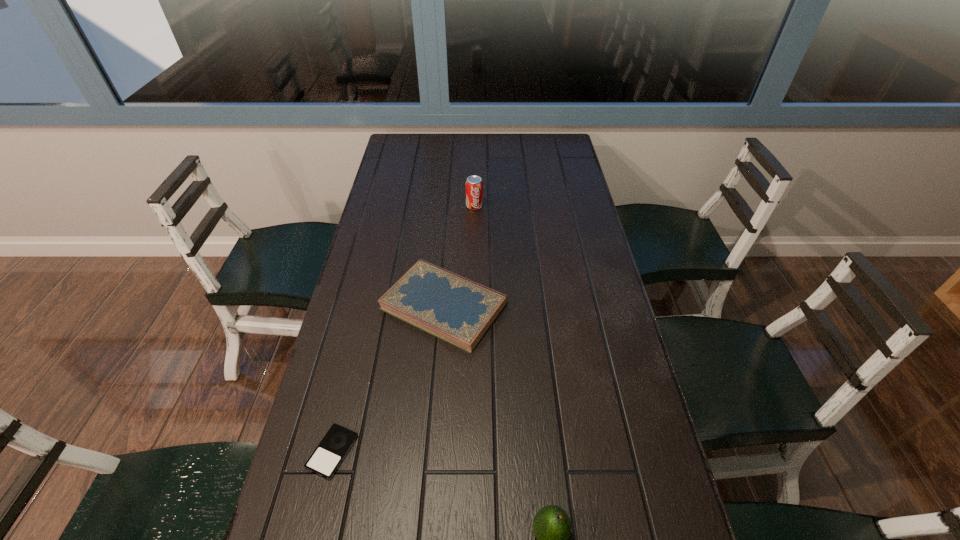
In the image, there is a desktop. At what (x,y) coordinates should I click in order to perform the action: click on vacant space at the far edge. Please return your answer as a coordinate pair (x, y). Image resolution: width=960 pixels, height=540 pixels. Looking at the image, I should click on (491, 142).

This screenshot has width=960, height=540. In the image, there is a desktop. Find the location of `vacant space at the left edge`. vacant space at the left edge is located at coordinates (404, 236).

You are a GUI agent. You are given a task and a screenshot of the screen. Output one action in this format:
    pyautogui.click(x=<x>, y=<y>)
    Task: Click on the free spot at the right edge of the desktop
    The image size is (960, 540).
    Given the screenshot: What is the action you would take?
    pyautogui.click(x=554, y=280)

Locate an element on the screen. The height and width of the screenshot is (540, 960). vacant area that lies between the paperback book and the soda can is located at coordinates (459, 256).

Identify the location of free spot between the third farthest object and the soda can. (403, 329).

Where is `blank region between the soda can and the third tallest object`? blank region between the soda can and the third tallest object is located at coordinates (459, 256).

At what (x,y) coordinates should I click in order to perform the action: click on vacant point located between the paperback book and the soda can. Please return your answer as a coordinate pair (x, y). Image resolution: width=960 pixels, height=540 pixels. Looking at the image, I should click on (459, 256).

Find the location of `empty location between the soda can and the shortest object`. empty location between the soda can and the shortest object is located at coordinates (403, 329).

Identify which object is the nearest to the avocado. Please provide its 2D coordinates. Your answer should be formatted as a tuple, i.e. [(x, y)], where the tuple contains the x and y coordinates of a point satisfying the conditions above.

[(331, 451)]

Locate which object is the second closest to the soda can. Please provide its 2D coordinates. Your answer should be formatted as a tuple, i.e. [(x, y)], where the tuple contains the x and y coordinates of a point satisfying the conditions above.

[(331, 451)]